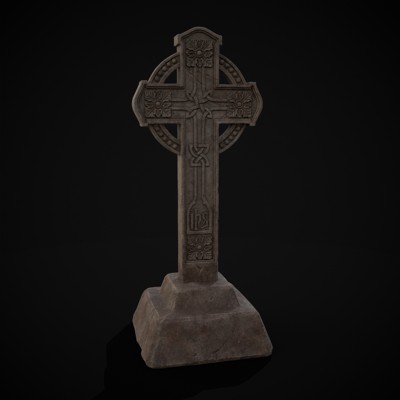
You are a GUI agent. You are given a task and a screenshot of the screen. Output one action in this format:
    pyautogui.click(x=<x>, y=<y>)
    Task: Click on the corners
    Image resolution: width=400 pixels, height=400 pixels.
    Given the screenshot: What is the action you would take?
    pyautogui.click(x=268, y=348), pyautogui.click(x=253, y=310), pyautogui.click(x=231, y=285), pyautogui.click(x=159, y=316), pyautogui.click(x=148, y=364), pyautogui.click(x=176, y=290), pyautogui.click(x=147, y=289), pyautogui.click(x=166, y=274)